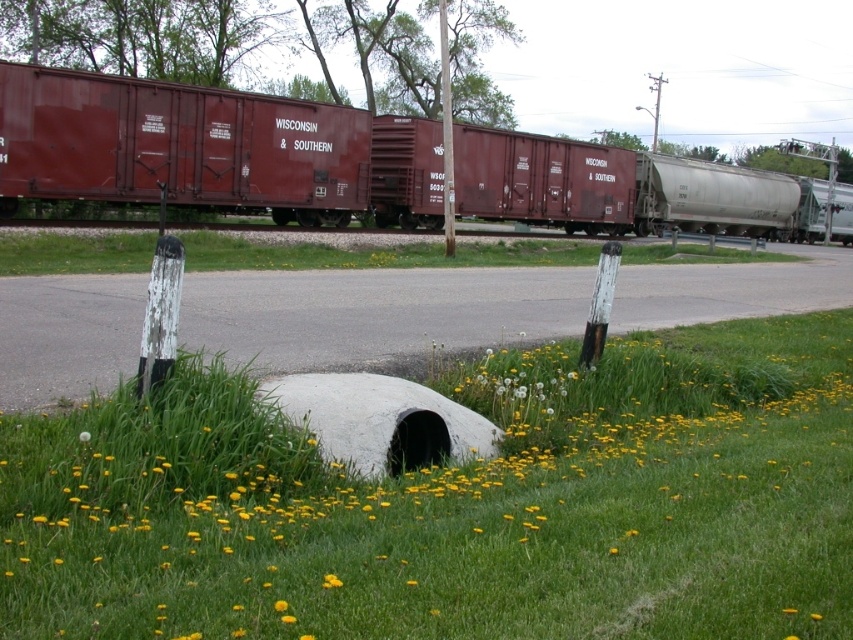
Who is more forward, (640, 188) or (282, 608)?

Point (282, 608) is more forward.

Who is more forward, (793, 180) or (277, 602)?

Point (277, 602) is more forward.

Where is `silver metallic tanker at right`? silver metallic tanker at right is located at coordinates (711, 196).

Is green grass at center further to camera compared to smooth wooden post at center?

No, green grass at center is in front of smooth wooden post at center.

Does point (352, 248) come in front of point (447, 144)?

That is True.

At what (x,y) coordinates should I click in order to perform the action: click on green grass at center. Please return your answer as a coordinate pair (x, y). Image resolution: width=853 pixels, height=640 pixels. Looking at the image, I should click on (374, 253).

You are a GUI agent. You are given a task and a screenshot of the screen. Output one action in this format:
    pyautogui.click(x=<x>, y=<y>)
    Task: Click on the green grass at center
    The image size is (853, 640).
    Given the screenshot: What is the action you would take?
    pyautogui.click(x=374, y=253)

Does maroon corrugated metal train car at center have a greater height compared to silver metallic tanker at right?

Yes, maroon corrugated metal train car at center is taller than silver metallic tanker at right.

Is maroon corrugated metal train car at center above silver metallic tanker at right?

No, maroon corrugated metal train car at center is not above silver metallic tanker at right.

Image resolution: width=853 pixels, height=640 pixels. In order to click on maroon corrugated metal train car at center in this screenshot , I will do `click(212, 148)`.